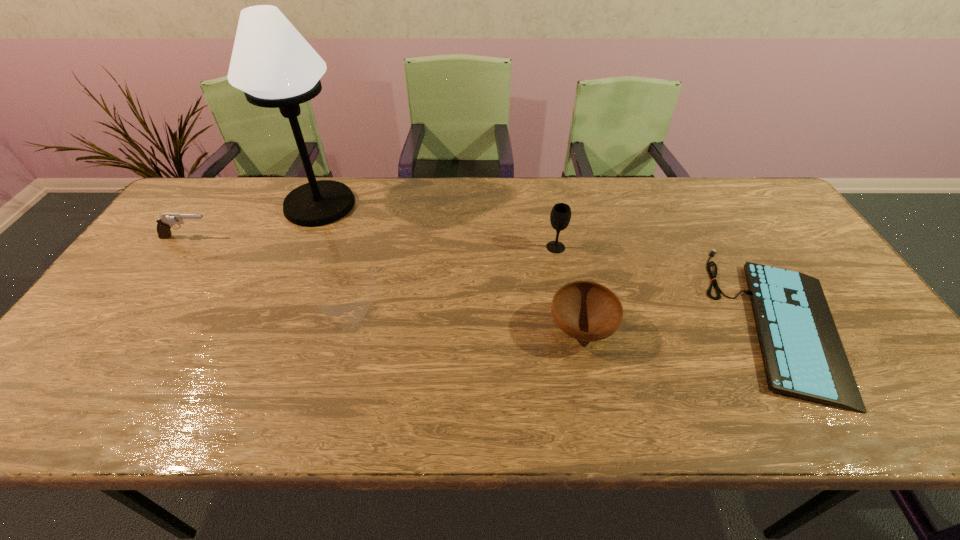
The width and height of the screenshot is (960, 540). Identify the location of object that stands as the fourth closest to the computer keyboard. (166, 221).

Identify the location of the second closest object to the rightmost object. This screenshot has width=960, height=540. (560, 216).

In order to click on free space that satisfies the following two spatial constraints: 1. at the muzzle of the bowl; 2. on the left side of the leftmost object in this screenshot , I will do `click(123, 329)`.

Locate an element on the screen. The image size is (960, 540). free spot that satisfies the following two spatial constraints: 1. at the muzzle of the computer keyboard; 2. on the right side of the leftmost object is located at coordinates (131, 319).

Identify the location of vacant point that satisfies the following two spatial constraints: 1. at the muzzle of the shortest object; 2. on the left side of the fourth nearest object. The image size is (960, 540). (131, 319).

In order to click on vacant region that satisfies the following two spatial constraints: 1. at the muzzle of the gun; 2. on the left side of the shortest object in this screenshot , I will do `click(131, 319)`.

At what (x,y) coordinates should I click in order to perform the action: click on free spot that satisfies the following two spatial constraints: 1. at the muzzle of the gun; 2. on the right side of the wineglass. Please return your answer as a coordinate pair (x, y). The height and width of the screenshot is (540, 960). Looking at the image, I should click on (180, 247).

Identify the location of free space in the image that satisfies the following two spatial constraints: 1. at the muzzle of the second farthest object; 2. on the left side of the wineglass. This screenshot has height=540, width=960. click(x=180, y=247).